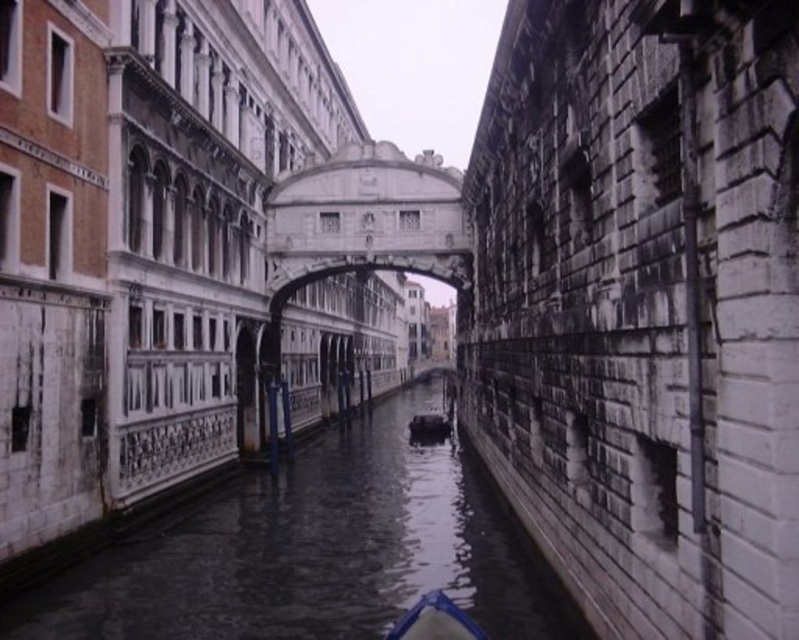
Between smooth stone canal at center and white stone bridge at center, which one is positioned lower?

smooth stone canal at center is lower down.

Which is in front, point (411, 452) or point (324, 164)?

Positioned in front is point (324, 164).

Who is more distant from viewer, [177,518] or [275,310]?

Point [275,310]

Where is `smooth stone canal at center`? smooth stone canal at center is located at coordinates (315, 550).

Who is higher up, smooth stone canal at center or blue plastic boat at center?

smooth stone canal at center

The image size is (799, 640). Describe the element at coordinates (315, 550) in the screenshot. I see `smooth stone canal at center` at that location.

Who is more forward, (434,545) or (432,625)?

Point (432,625) is in front.

Where is `smooth stone canal at center`? This screenshot has height=640, width=799. smooth stone canal at center is located at coordinates (315, 550).

Does point (470, 257) come in front of point (444, 620)?

No, it is behind (444, 620).

Can you confirm if white stone bridge at center is taller than blue plastic boat at center?

Yes, white stone bridge at center is taller than blue plastic boat at center.

At what (x,y) coordinates should I click in order to perform the action: click on white stone bridge at center. Please return your answer as a coordinate pair (x, y). The image size is (799, 640). Looking at the image, I should click on (360, 227).